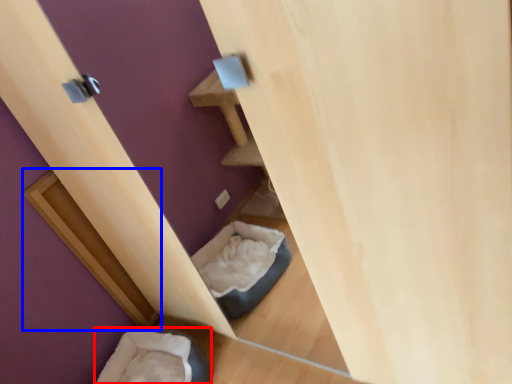
Question: Which point is further to the camera, bean bag chair (highlighted by a red box) or wood (highlighted by a blue box)?

Choices:
 (A) bean bag chair
 (B) wood

Answer: (B)